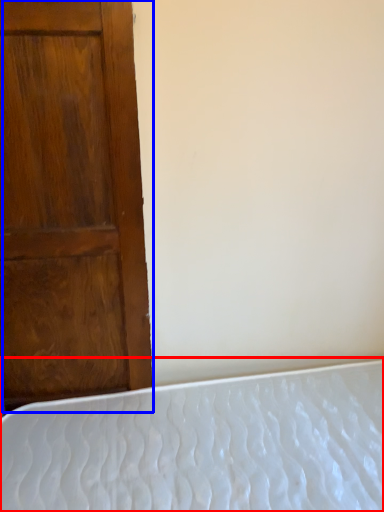
Question: Which of the following is the farthest to the observer, bed (highlighted by a red box) or door (highlighted by a blue box)?

Choices:
 (A) bed
 (B) door

Answer: (B)